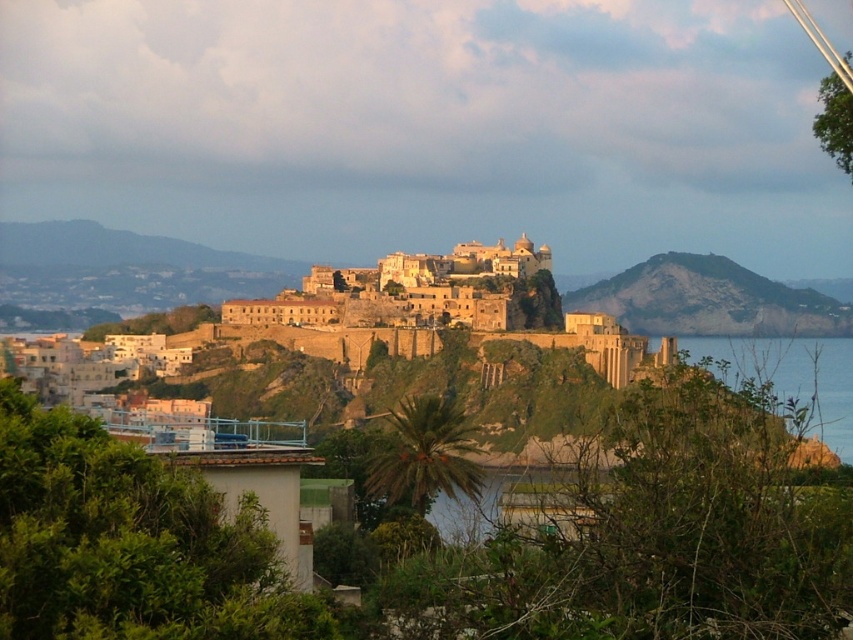
Between green rocky hillside at center and blue water at lower right, which one has less height?

Standing shorter between the two is green rocky hillside at center.

Where is `green rocky hillside at center`? This screenshot has height=640, width=853. green rocky hillside at center is located at coordinates (709, 300).

Does yellow stone town at center have a greater height compared to blue water at lower right?

Yes, yellow stone town at center is taller than blue water at lower right.

Is point (196, 257) positioned before point (753, 355)?

No.

Who is more distant from viewer, (73, 250) or (827, 388)?

The point (73, 250) is behind.

You are a GUI agent. You are given a task and a screenshot of the screen. Output one action in this format:
    pyautogui.click(x=<x>, y=<y>)
    Task: Click on the yellow stone town at center
    The height and width of the screenshot is (640, 853).
    Given the screenshot: What is the action you would take?
    pyautogui.click(x=426, y=323)

Who is positioned more to the right, yellow stone town at center or green rocky hillside at center?

green rocky hillside at center is more to the right.

Does point (328, 291) lie behind point (735, 285)?

No, (328, 291) is closer to viewer.

Who is more distant from viewer, (236, 280) or (701, 310)?

Point (236, 280)

Find the location of `yellow stone town at center`. yellow stone town at center is located at coordinates (426, 323).